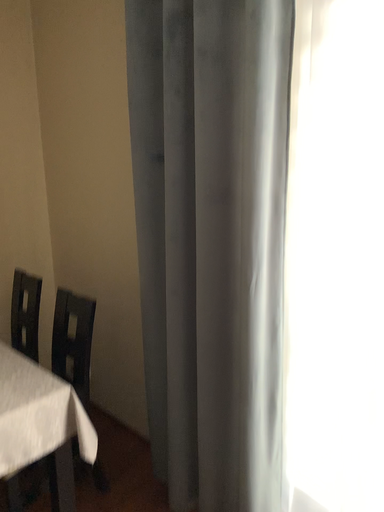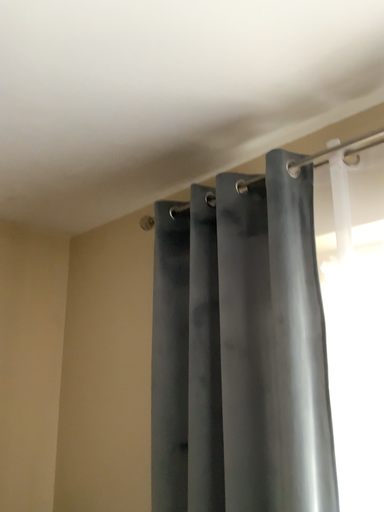
Question: How did the camera likely rotate when shooting the video?

Choices:
 (A) rotated downward
 (B) rotated upward

Answer: (B)